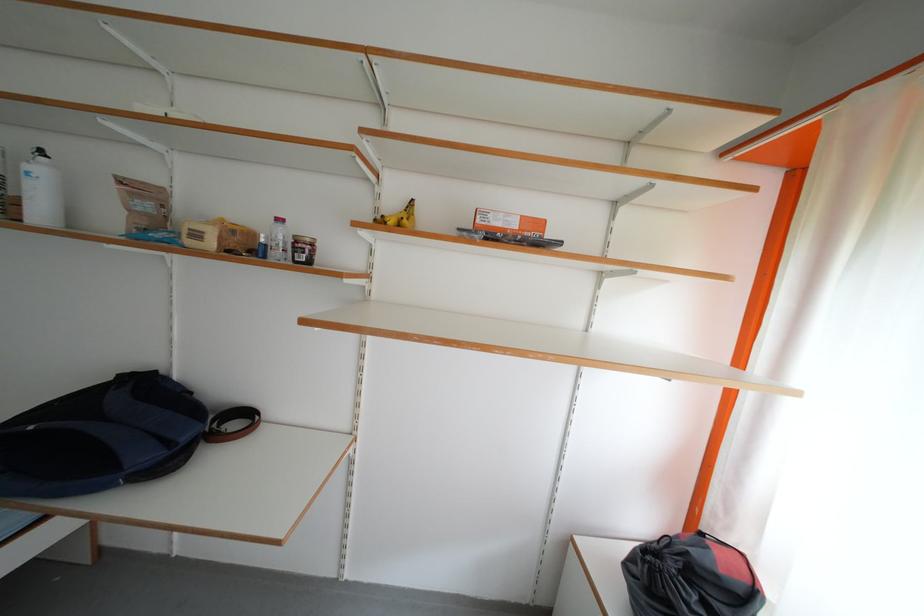
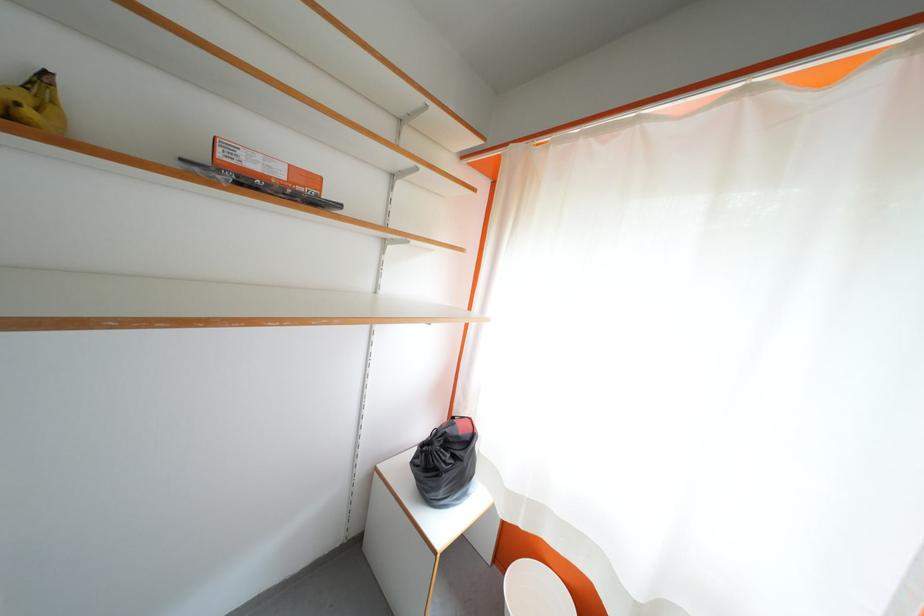
In the second image, find the point that corresponds to point 523,228 in the first image.

(289, 177)